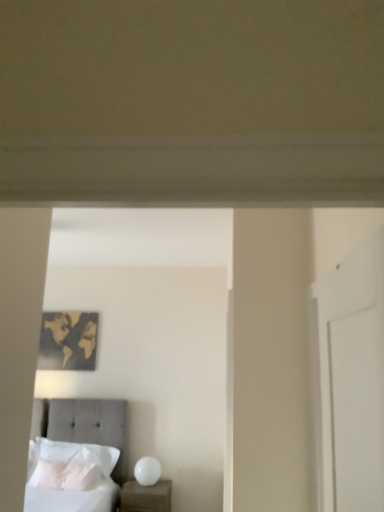
Question: Does gold metallic world map at upper left appear on the left side of white soft pillow at lower left, which ranks as the 2th pillow in front-to-back order?

Choices:
 (A) yes
 (B) no

Answer: (A)

Question: Is gold metallic world map at upper left looking in the opposite direction of white soft pillow at lower left, which ranks as the 2th pillow in front-to-back order?

Choices:
 (A) no
 (B) yes

Answer: (A)

Question: Would you say gold metallic world map at upper left is a long distance from white soft pillow at lower left, the first pillow positioned from the back?

Choices:
 (A) yes
 (B) no

Answer: (B)

Question: Is gold metallic world map at upper left closer to camera compared to white soft pillow at lower left, which ranks as the 2th pillow in front-to-back order?

Choices:
 (A) yes
 (B) no

Answer: (B)

Question: From a real-world perspective, is gold metallic world map at upper left beneath white soft pillow at lower left, which ranks as the 2th pillow in front-to-back order?

Choices:
 (A) yes
 (B) no

Answer: (B)

Question: Can we say gold metallic world map at upper left lies outside white soft pillow at lower left, which ranks as the 2th pillow in front-to-back order?

Choices:
 (A) yes
 (B) no

Answer: (A)

Question: Is white soft pillow at lower left, which ranks as the 2th pillow in front-to-back order, closer to the viewer compared to white glossy nightstand at lower center?

Choices:
 (A) no
 (B) yes

Answer: (A)

Question: Does white soft pillow at lower left, which ranks as the 2th pillow in front-to-back order, have a greater width compared to white glossy nightstand at lower center?

Choices:
 (A) yes
 (B) no

Answer: (B)

Question: From a real-world perspective, does white soft pillow at lower left, which ranks as the 2th pillow in front-to-back order, stand above white glossy nightstand at lower center?

Choices:
 (A) no
 (B) yes

Answer: (B)

Question: Is white soft pillow at lower left, which ranks as the 2th pillow in front-to-back order, looking in the opposite direction of white glossy nightstand at lower center?

Choices:
 (A) yes
 (B) no

Answer: (B)

Question: Could you tell me if white soft pillow at lower left, the first pillow positioned from the back, is turned towards white glossy nightstand at lower center?

Choices:
 (A) yes
 (B) no

Answer: (B)

Question: Is white glossy nightstand at lower center surrounded by white soft pillow at lower left, which ranks as the 2th pillow in front-to-back order?

Choices:
 (A) yes
 (B) no

Answer: (B)

Question: Is tufted fabric bed at lower left next to gold metallic world map at upper left and touching it?

Choices:
 (A) no
 (B) yes

Answer: (A)